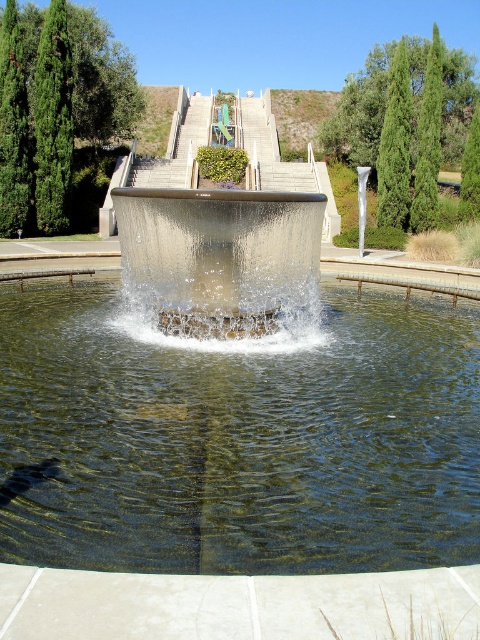
Question: Can you confirm if clear glass pond at center is positioned above clear glass water feature at center?

Choices:
 (A) yes
 (B) no

Answer: (B)

Question: Is clear glass pond at center further to the viewer compared to clear glass water feature at center?

Choices:
 (A) no
 (B) yes

Answer: (A)

Question: Which of the following is the farthest from the observer?

Choices:
 (A) clear glass pond at center
 (B) clear glass water feature at center

Answer: (B)

Question: Considering the relative positions of clear glass pond at center and clear glass water feature at center in the image provided, where is clear glass pond at center located with respect to clear glass water feature at center?

Choices:
 (A) above
 (B) below

Answer: (B)

Question: Which object is closer to the camera taking this photo?

Choices:
 (A) clear glass water feature at center
 (B) clear glass pond at center

Answer: (B)

Question: Which point is closer to the camera taking this photo?

Choices:
 (A) (216, 292)
 (B) (407, 513)

Answer: (B)